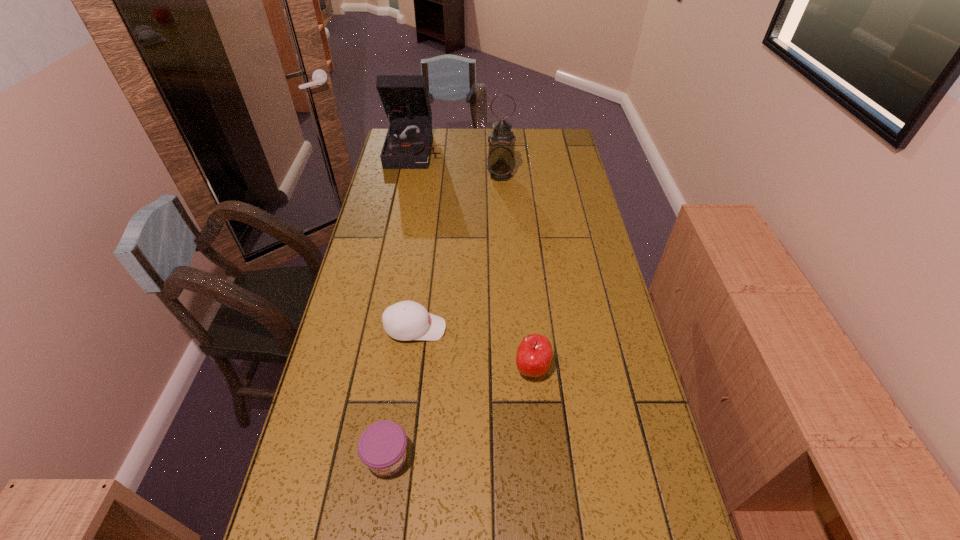
I want to click on oil lamp, so 500,163.

Where is `phonograph_record`? Image resolution: width=960 pixels, height=540 pixels. phonograph_record is located at coordinates (405, 99).

You are a GUI agent. You are given a task and a screenshot of the screen. Output one action in this format:
    pyautogui.click(x=<x>, y=<y>)
    Task: Click on the fourth farthest object
    The image size is (960, 540).
    Given the screenshot: What is the action you would take?
    click(x=534, y=354)

Locate an element on the screen. The image size is (960, 540). the third shortest object is located at coordinates (534, 354).

I want to click on baseball cap, so click(x=406, y=320).

Identify the location of jam. (382, 446).

This screenshot has width=960, height=540. I want to click on blank space located 0.130m on the back of the oil lamp, so click(x=499, y=152).

You are a GUI agent. You are given a task and a screenshot of the screen. Output one action in this format:
    pyautogui.click(x=<x>, y=<y>)
    Task: Click on the vacant position located on the front-facing side of the phonograph_record
    
    Given the screenshot: What is the action you would take?
    (408, 185)

Locate an element on the screen. Image resolution: width=960 pixels, height=540 pixels. vacant region located on the right of the second nearest object is located at coordinates (588, 369).

You are a GUI agent. You are given a task and a screenshot of the screen. Output one action in this format:
    pyautogui.click(x=<x>, y=<y>)
    Task: Click on the vacant area situated 0.300m on the front-facing side of the third farthest object
    This screenshot has height=540, width=960.
    Given the screenshot: What is the action you would take?
    pyautogui.click(x=549, y=328)